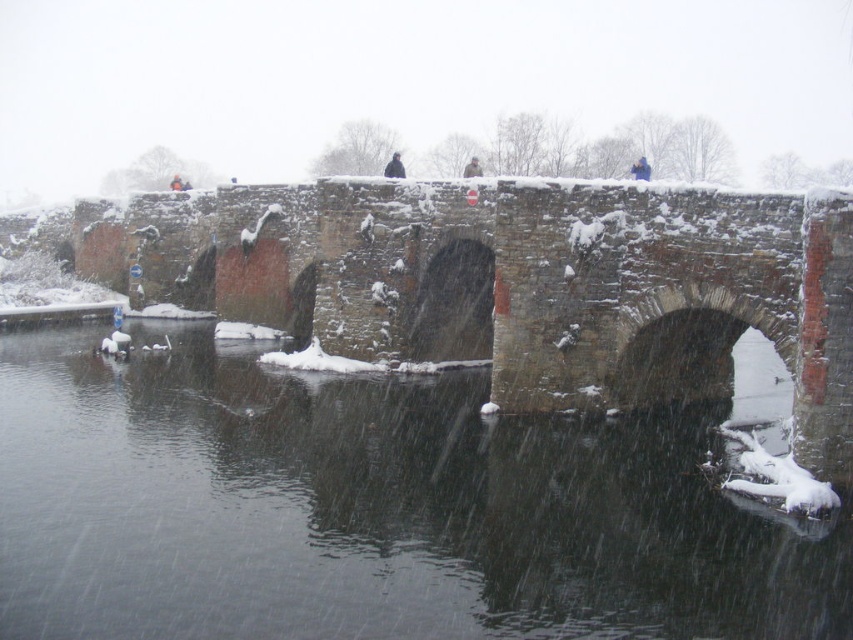
Can you confirm if blue fabric person at upper center is taller than light brown fur coat at center?

Indeed, blue fabric person at upper center has a greater height compared to light brown fur coat at center.

Between blue fabric person at upper center and light brown fur coat at center, which one is positioned lower?

Positioned lower is blue fabric person at upper center.

Is point (634, 168) less distant than point (479, 172)?

No, it is not.

In order to click on blue fabric person at upper center in this screenshot , I will do `click(640, 168)`.

Who is higher up, black stone water at center or dark blue jacket at center?

dark blue jacket at center is higher up.

Find the location of a particular element. This screenshot has height=640, width=853. black stone water at center is located at coordinates (379, 508).

Is point (648, 634) in front of point (395, 168)?

That is True.

The image size is (853, 640). Identify the location of black stone water at center. coord(379,508).

What do you see at coordinates (508, 282) in the screenshot? I see `snow-covered stone bridge at center` at bounding box center [508, 282].

Find the location of `snow-covered stone bridge at center`. snow-covered stone bridge at center is located at coordinates (508, 282).